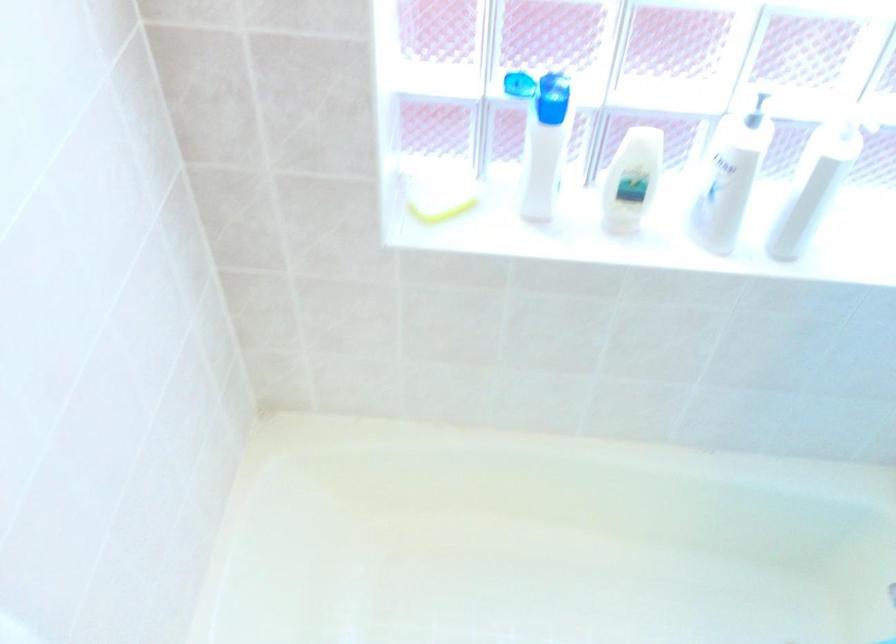
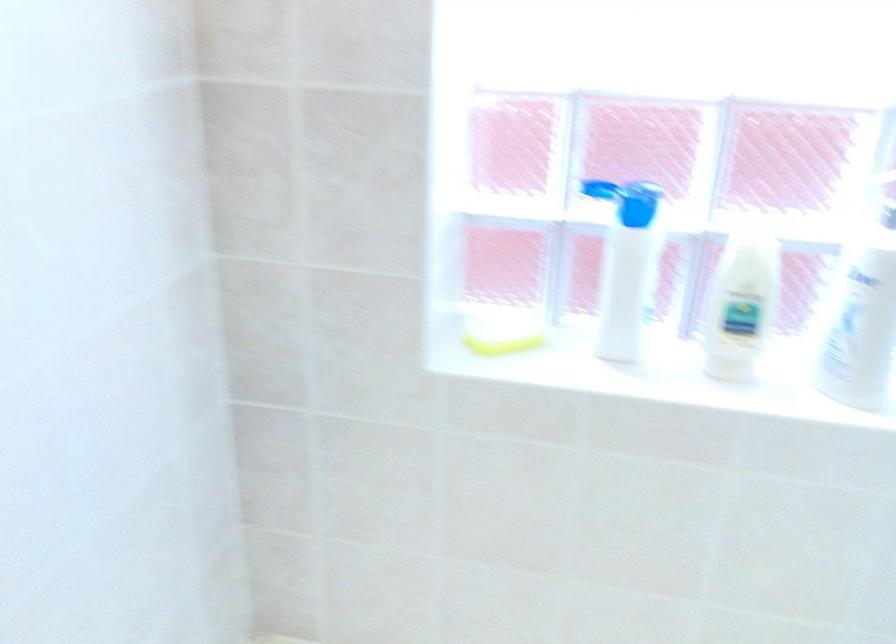
Locate, in the second image, the point that corresponds to (722,196) in the first image.

(860, 323)